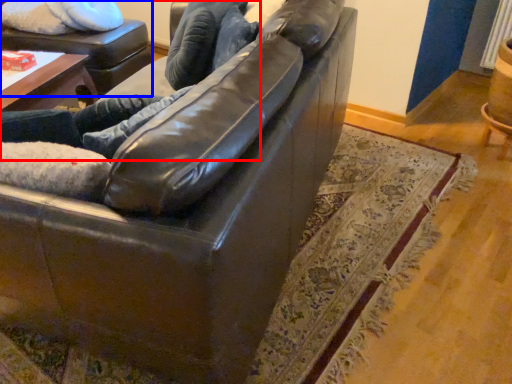
Question: Among these objects, which one is farthest to the camera, couple (highlighted by a red box) or swivel chair (highlighted by a blue box)?

Choices:
 (A) couple
 (B) swivel chair

Answer: (B)